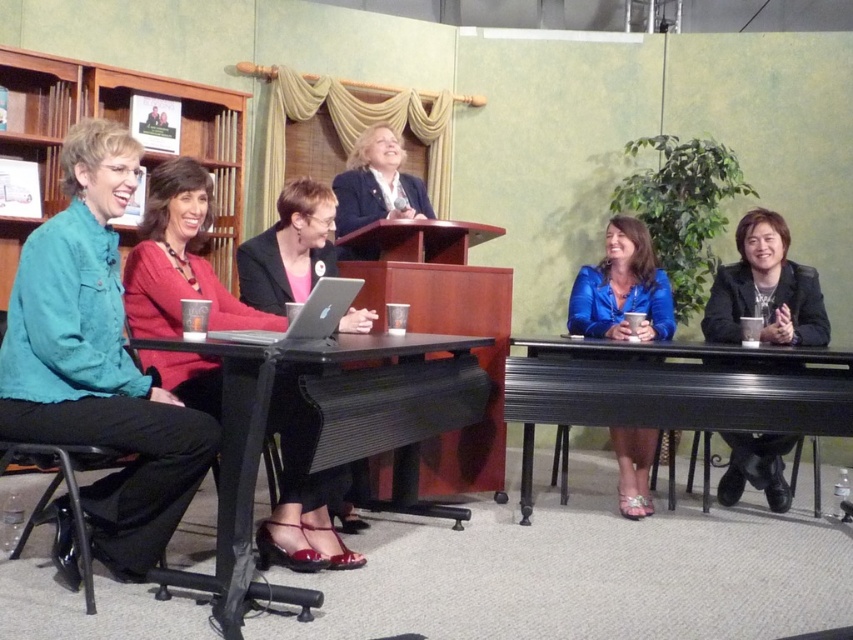
Is black metal table at lower right to the left of matte black blazer at center from the viewer's perspective?

In fact, black metal table at lower right is to the right of matte black blazer at center.

The height and width of the screenshot is (640, 853). What do you see at coordinates (672, 388) in the screenshot?
I see `black metal table at lower right` at bounding box center [672, 388].

Locate an element on the screen. black metal table at lower right is located at coordinates (672, 388).

Looking at this image, between black metal table at lower right and silver metallic laptop at center, which one has less height?

silver metallic laptop at center is shorter.

Is black metal table at lower right above silver metallic laptop at center?

Incorrect, black metal table at lower right is not positioned above silver metallic laptop at center.

Does point (590, 387) come farther from viewer compared to point (355, 289)?

Yes, it is.

You are a GUI agent. You are given a task and a screenshot of the screen. Output one action in this format:
    pyautogui.click(x=<x>, y=<y>)
    Task: Click on the black metal table at lower right
    
    Given the screenshot: What is the action you would take?
    pyautogui.click(x=672, y=388)

Is blue satin dress at center to the right of matte black blazer at center from the viewer's perspective?

Correct, you'll find blue satin dress at center to the right of matte black blazer at center.

Is blue satin dress at center wider than matte black blazer at center?

Yes, blue satin dress at center is wider than matte black blazer at center.

Is point (650, 250) positioned in front of point (387, 129)?

No, it is behind (387, 129).

Image resolution: width=853 pixels, height=640 pixels. In order to click on blue satin dress at center in this screenshot , I will do `click(622, 289)`.